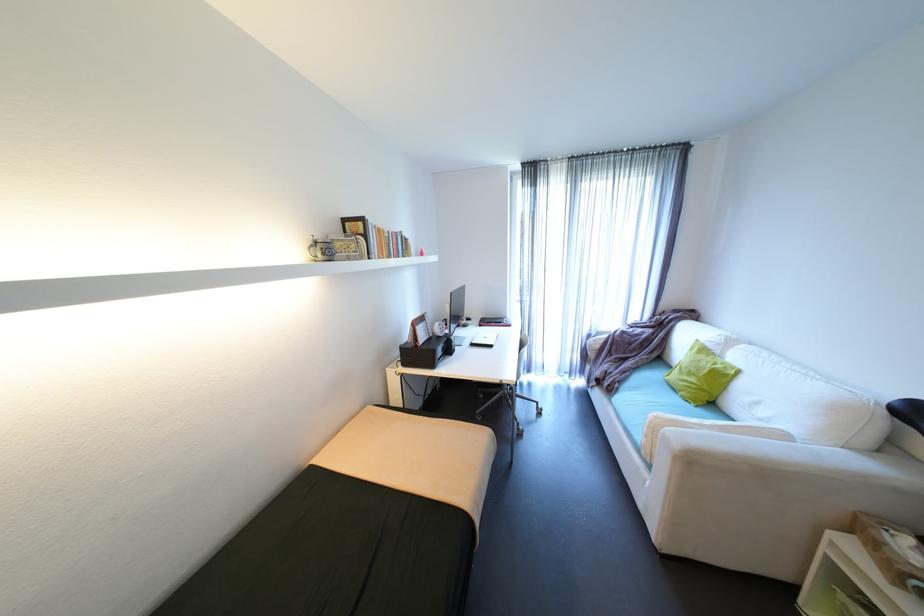
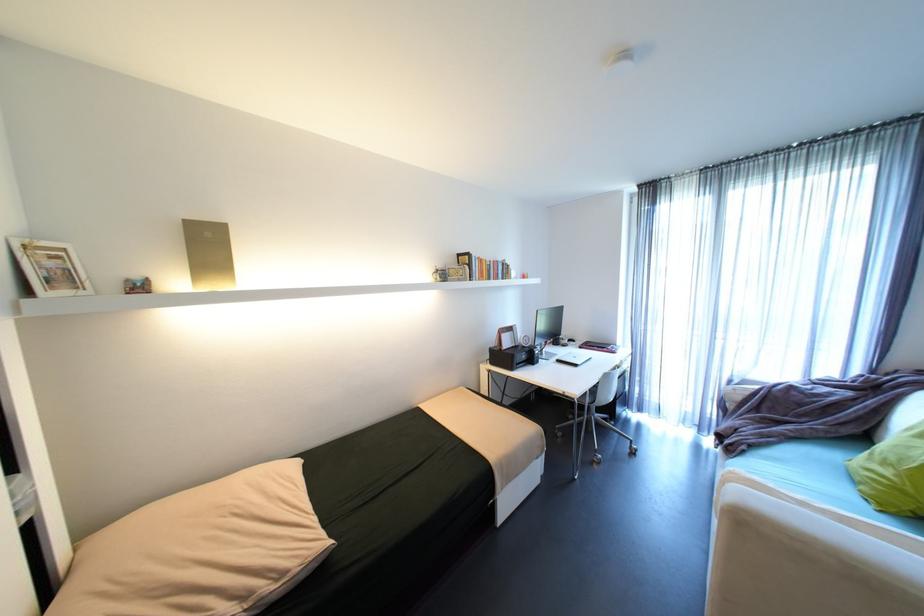
Where in the second image is the point corresponding to (x=706, y=381) from the first image?

(906, 476)